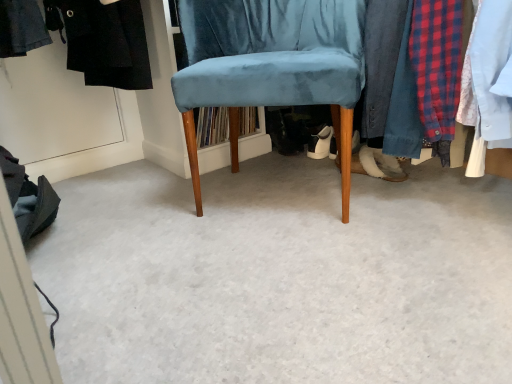
Question: Should I look upward or downward to see velvet blue chair at center?

Choices:
 (A) up
 (B) down

Answer: (A)